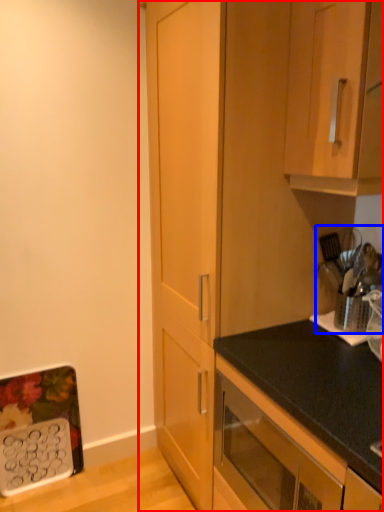
Question: Which point is further to the camera, cabinetry (highlighted by a red box) or appliance (highlighted by a blue box)?

Choices:
 (A) cabinetry
 (B) appliance

Answer: (B)